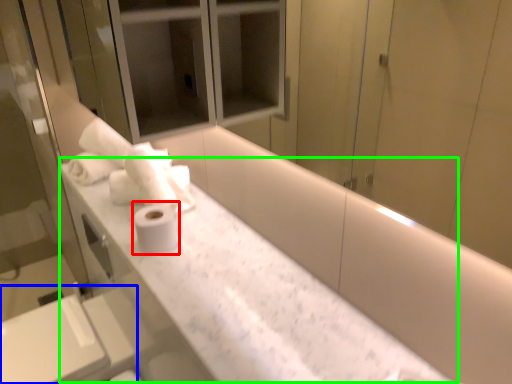
Question: Which object is positioned closest to toilet paper (highlighted by a red box)? Select from sink (highlighted by a blue box) and counter (highlighted by a green box).

Choices:
 (A) sink
 (B) counter

Answer: (B)